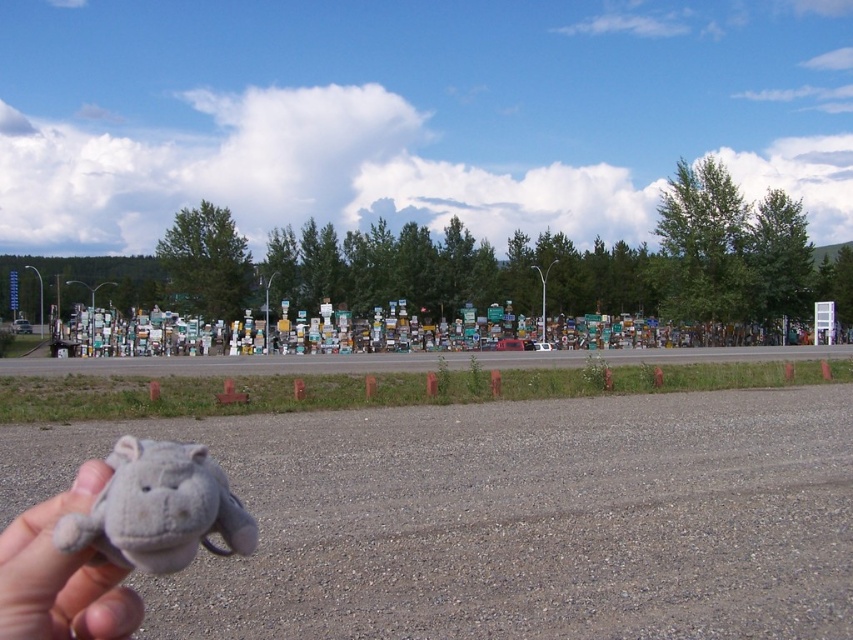
You are a photographer trying to capture both the gray plush hippo at lower left and the fuzzy gray stuffed animal at lower left in a single frame. Given that your camera has a minimum focus distance of 10 centimeters, will you be able to focus on both objects clearly?

The gray plush hippo at lower left is 12.40 centimeters away from the fuzzy gray stuffed animal at lower left. Since the distance between them is greater than the camera minimum focus distance of 10 centimeters, the camera can focus on both objects clearly as long as they are within the camera frame.

You are holding two stuffed animals, the gray plush hippo at lower left and the fuzzy gray stuffed animal at lower left. Which one is closer to your hand?

The gray plush hippo at lower left is closer to the viewer than the fuzzy gray stuffed animal at lower left.

You are standing at the hand holding the gray stuffed animal in the foreground. You want to walk towards the dense collection of colorful signs in the mid to background. There are two points marked on your path at coordinates point (242, 532) and point (49, 548). Which point will you encounter first as you move forward?

You will encounter point (49, 548) first because it is in front of point (242, 532) according to the spatial description provided.